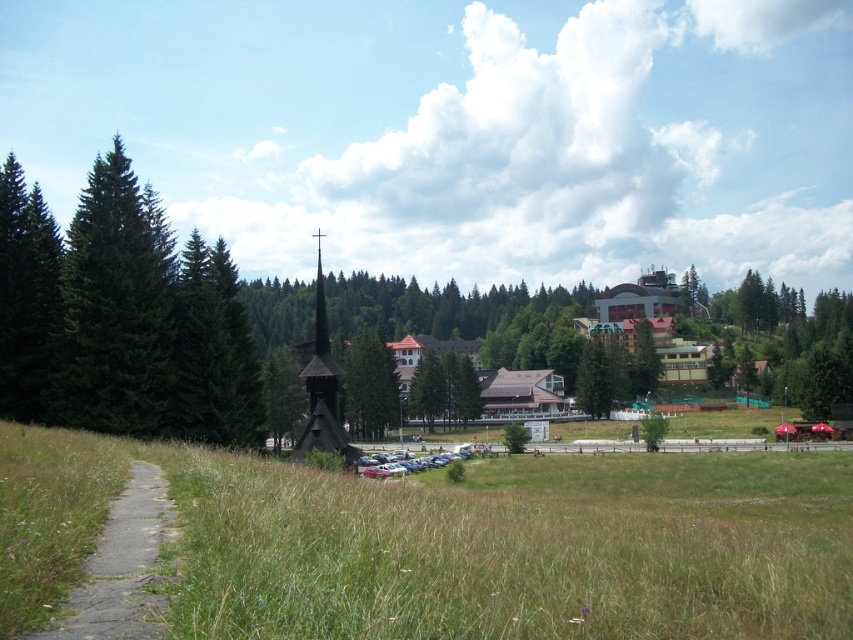
Question: Among these objects, which one is farthest from the camera?

Choices:
 (A) green matte tree at left
 (B) green leafy tree at center

Answer: (B)

Question: Does green matte tree at center appear on the right side of green leafy tree at center?

Choices:
 (A) no
 (B) yes

Answer: (A)

Question: Which object appears farthest from the camera in this image?

Choices:
 (A) green matte tree at left
 (B) gray concrete path at lower left

Answer: (A)

Question: Is green matte tree at left wider than green matte tree at center?

Choices:
 (A) yes
 (B) no

Answer: (B)

Question: Is green matte tree at left further to camera compared to green matte tree at center?

Choices:
 (A) no
 (B) yes

Answer: (A)

Question: Which object is farther from the camera taking this photo?

Choices:
 (A) green matte tree at left
 (B) green matte tree at center
 (C) green leafy tree at center

Answer: (B)